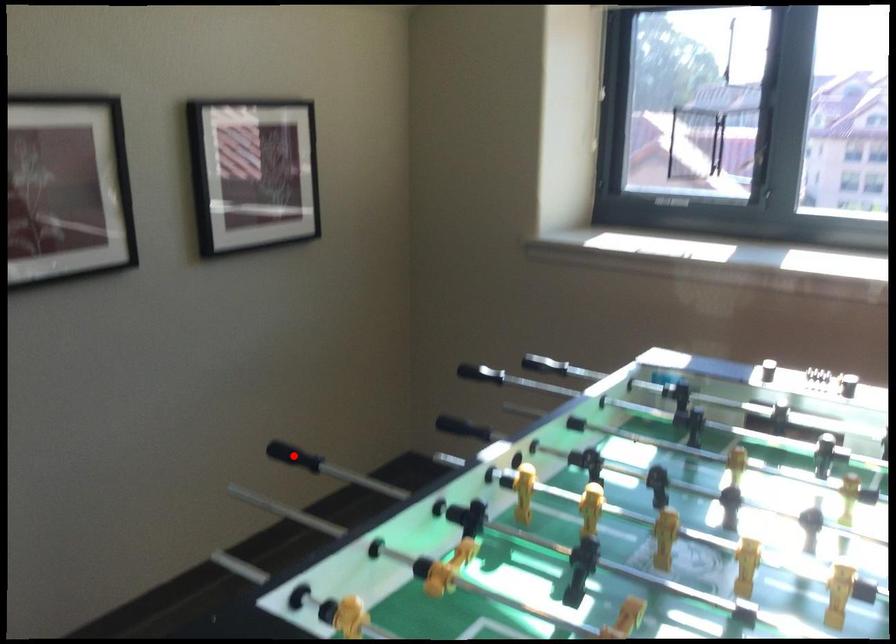
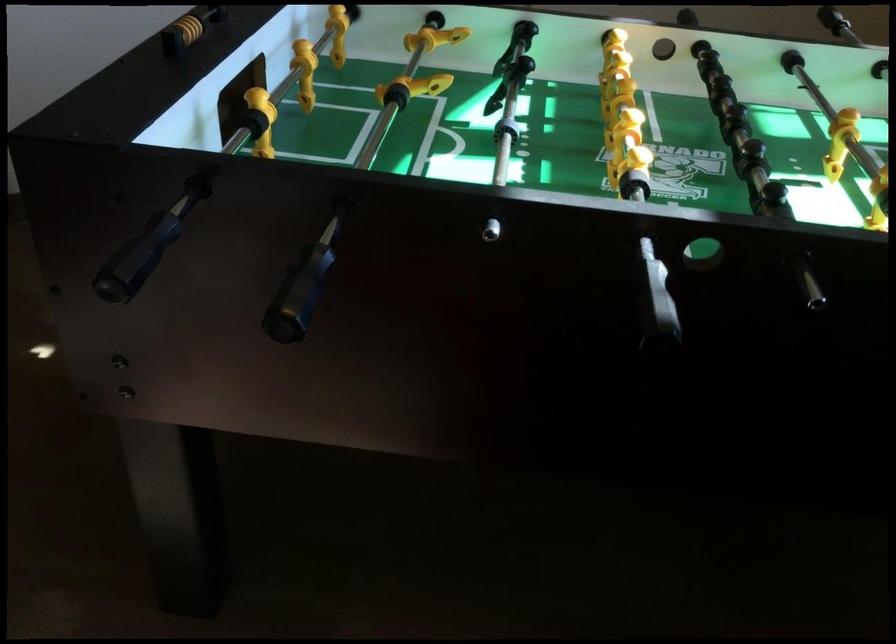
Question: I am providing you with two images of the same scene from different viewpoints. A red point is marked on the first image. Can you still see the location of the red point in image 2?

Choices:
 (A) Yes
 (B) No

Answer: (B)